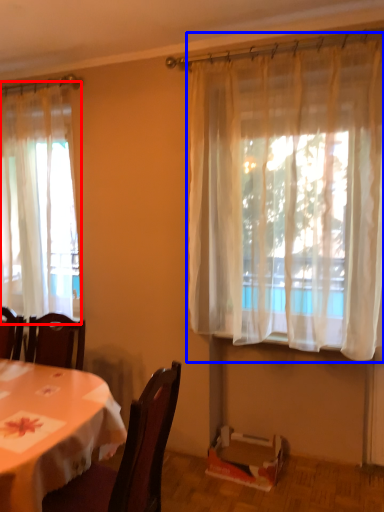
Question: Which of the following is the closest to the observer, curtain (highlighted by a red box) or curtain (highlighted by a blue box)?

Choices:
 (A) curtain
 (B) curtain

Answer: (B)